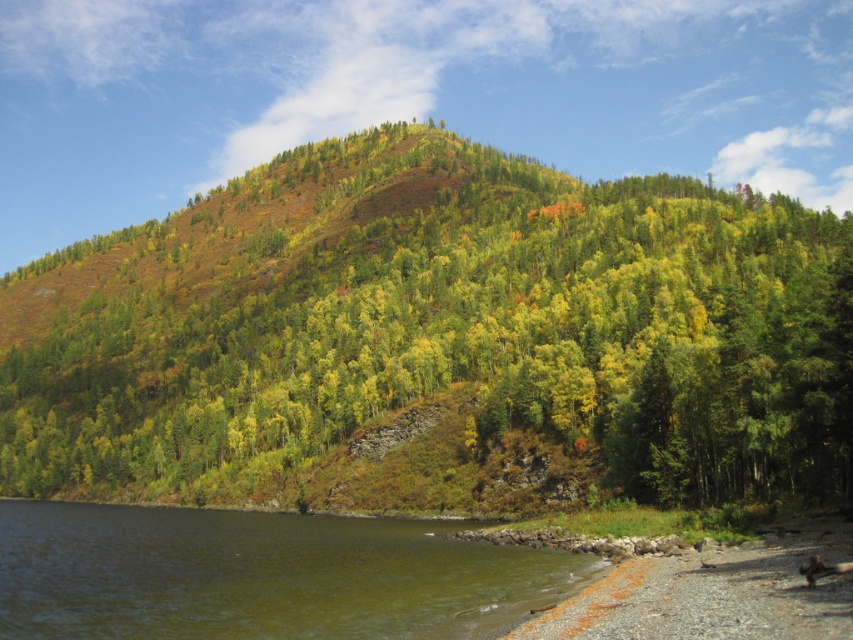
You are standing at the edge of the water in the scene. Which direction should you walk to reach the green leafy trees at center from the greenish water at lower left?

You should walk to the right from the greenish water at lower left to reach the green leafy trees at center because the green leafy trees at center are located to the left of the greenish water at lower left, meaning the trees are positioned in the opposite direction relative to the water.

You are standing at the edge of the greenish water at lower left and want to look up at the green leafy trees at center. Which direction should you face to see the top of the trees?

You should look upward because the green leafy trees at center are taller than the greenish water at lower left.

You are a hiker who wants to cross from the green leafy trees at center to the greenish water at lower left. Can you walk directly between them without any obstacles?

The green leafy trees at center and greenish water at lower left are 128.97 meters apart from each other. Since there is no mention of obstacles in the scene description, you can walk directly between them.